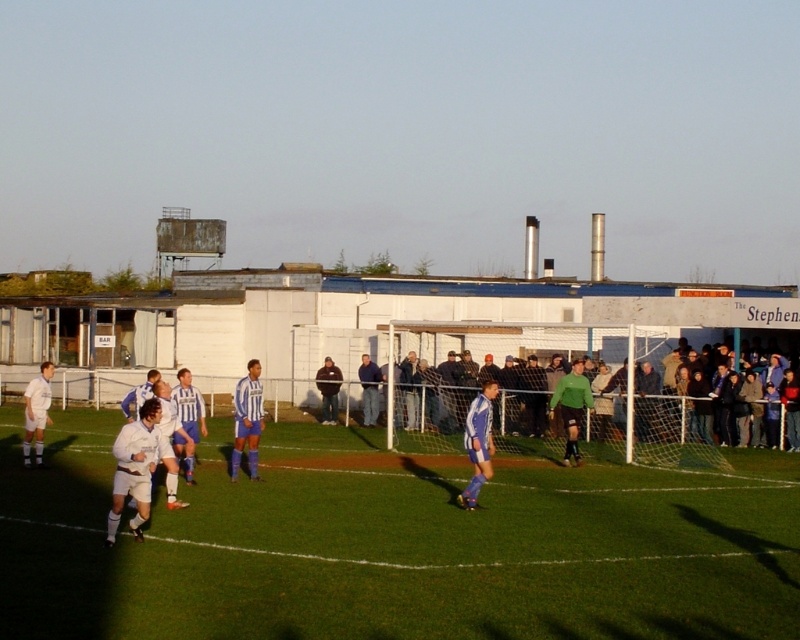
You are a photographer standing at the edge of the soccer field. You want to take a photo of the striped jersey at center and the dark blue jacket at center. According to the scene description, which object is covering part of the other?

The striped jersey at center is positioned over dark blue jacket at center, so the striped jersey is covering part of the dark blue jacket.